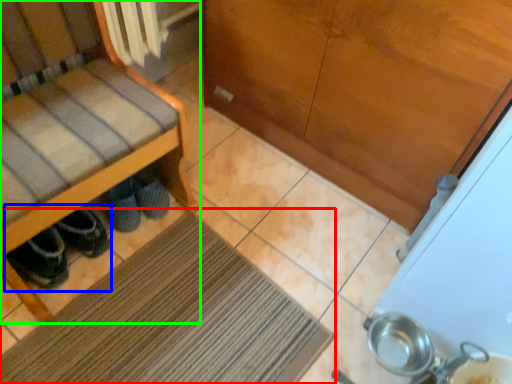
Question: Based on their relative distances, which object is nearer to mat (highlighted by a red box)? Choose from footwear (highlighted by a blue box) and furniture (highlighted by a green box).

Choices:
 (A) footwear
 (B) furniture

Answer: (A)